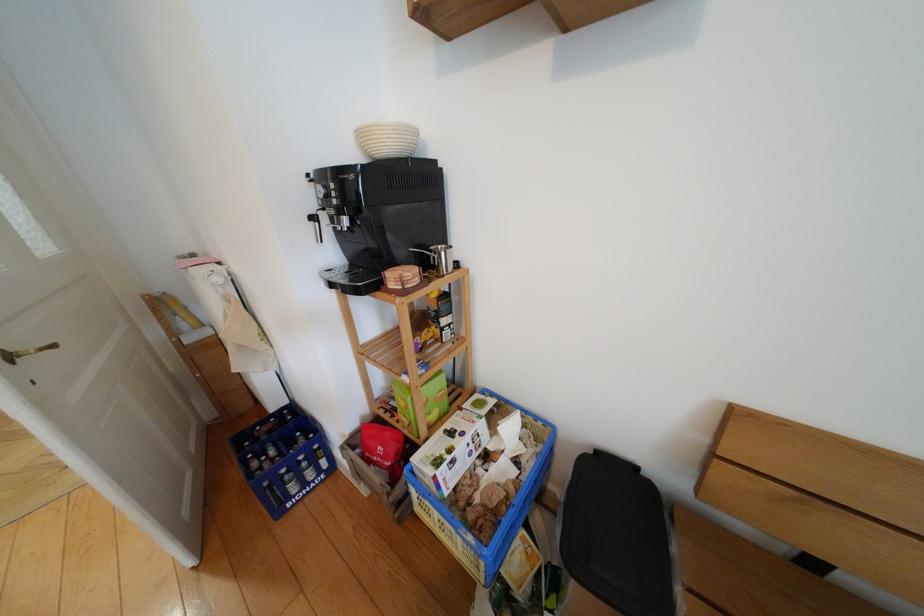
I want to click on steam wand handle, so click(x=25, y=352).